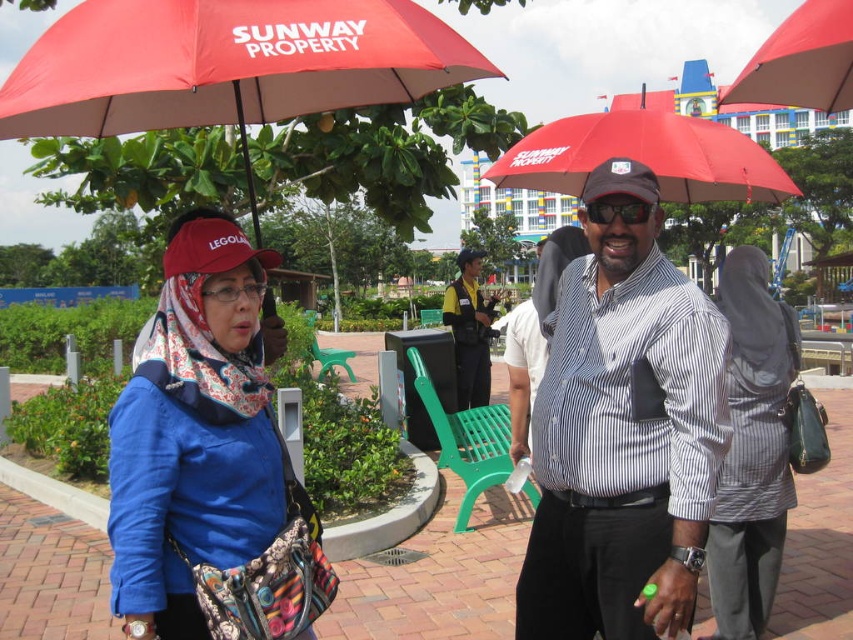
Question: Does matte blue shirt at center appear on the right side of yellow uniform at center?

Choices:
 (A) yes
 (B) no

Answer: (B)

Question: Which object is farther from the camera taking this photo?

Choices:
 (A) striped cotton shirt at center
 (B) matte blue shirt at center
 (C) yellow uniform at center
 (D) dark gray fabric hijab at center

Answer: (C)

Question: Which of these objects is positioned farthest from the striped cotton shirt at center?

Choices:
 (A) red matte umbrella at upper left
 (B) red matte umbrella at upper center
 (C) yellow uniform at center
 (D) red matte umbrella at center

Answer: (C)

Question: Does dark gray fabric hijab at center have a larger size compared to yellow uniform at center?

Choices:
 (A) yes
 (B) no

Answer: (A)

Question: Which object appears farthest from the camera in this image?

Choices:
 (A) red matte umbrella at upper left
 (B) striped cotton shirt at center

Answer: (A)

Question: Does red matte umbrella at upper left come behind red matte umbrella at center?

Choices:
 (A) yes
 (B) no

Answer: (B)